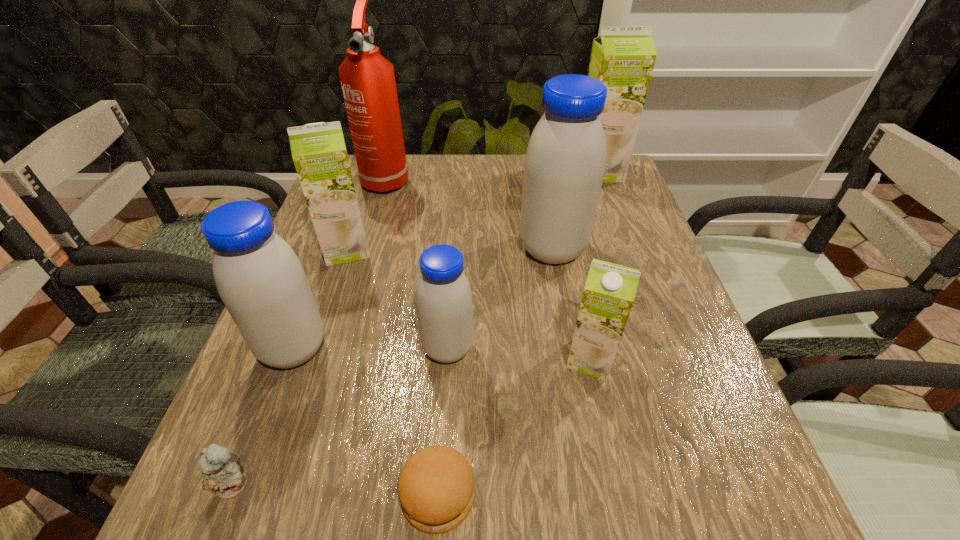
Where is `fire extinguisher`? The width and height of the screenshot is (960, 540). fire extinguisher is located at coordinates (368, 83).

Locate an element on the screen. The height and width of the screenshot is (540, 960). the farthest soya milk is located at coordinates (622, 58).

I want to click on the rightmost object, so click(x=622, y=58).

Find the location of a particular element. The height and width of the screenshot is (540, 960). the rightmost blue soya milk is located at coordinates (565, 161).

Locate an element on the screen. Image resolution: width=960 pixels, height=540 pixels. the farthest blue soya milk is located at coordinates (565, 161).

Where is `the second nearest green soya milk`? the second nearest green soya milk is located at coordinates (319, 153).

The width and height of the screenshot is (960, 540). I want to click on the second biggest green soya milk, so click(x=319, y=153).

Where is `the leftmost blue soya milk`? This screenshot has width=960, height=540. the leftmost blue soya milk is located at coordinates (259, 278).

This screenshot has width=960, height=540. I want to click on the nearest green soya milk, so click(609, 292).

Identify the location of the second green soya milk from right to left. (609, 292).